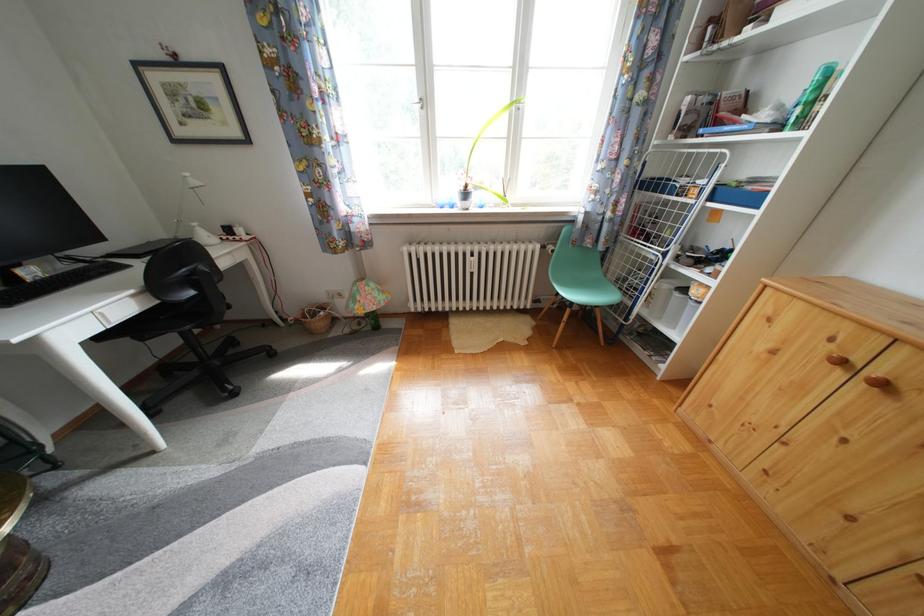
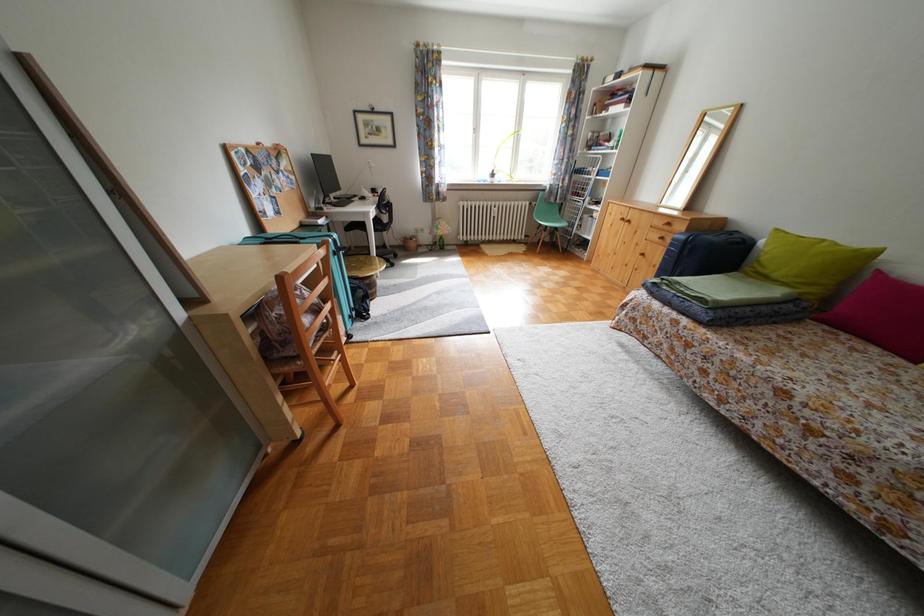
The images are taken continuously from a first-person perspective. In which direction are you moving?

The cameraman walked toward left, backward.